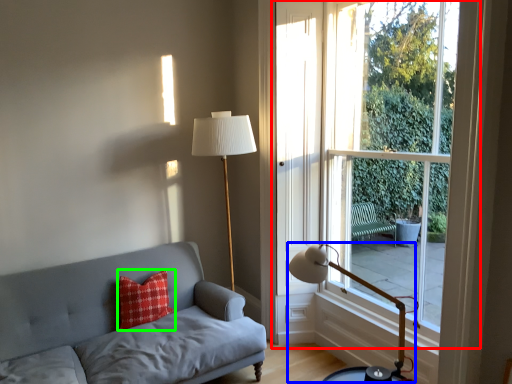
Question: Considering the real-world distances, which object is farthest from window (highlighted by a red box)? table lamp (highlighted by a blue box) or pillow (highlighted by a green box)?

Choices:
 (A) table lamp
 (B) pillow

Answer: (B)